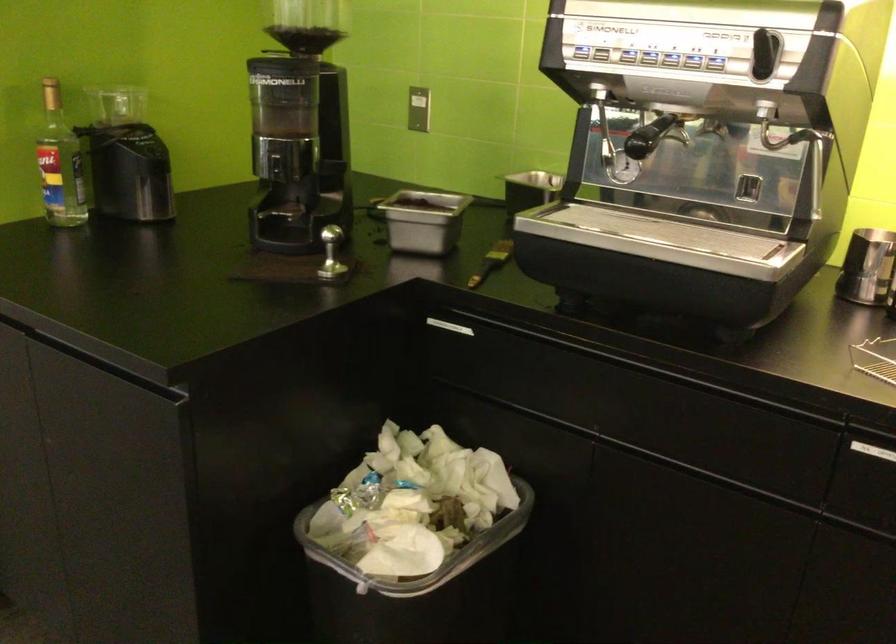
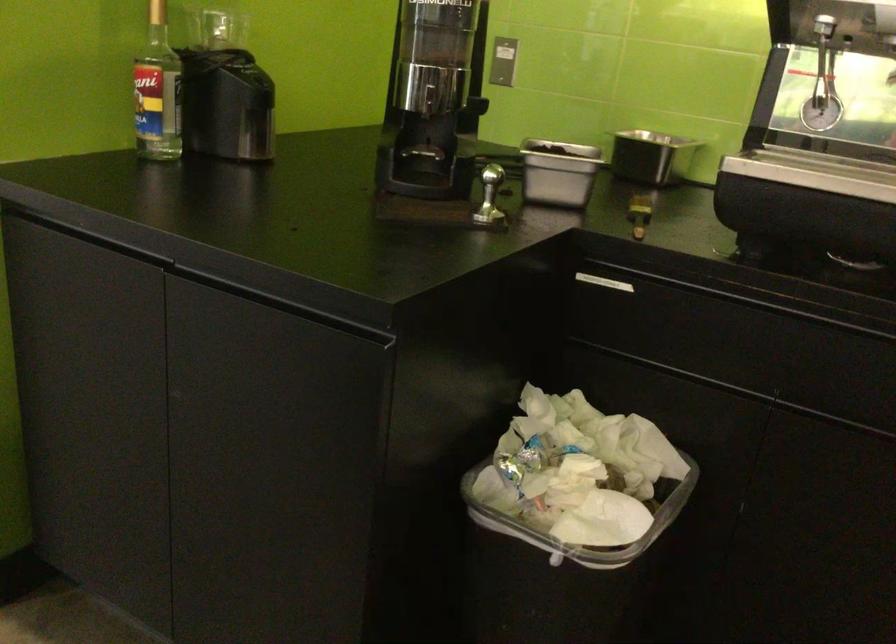
Question: The camera is either moving clockwise (left) or counter-clockwise (right) around the object. The first image is from the beginning of the video and the second image is from the end. Is the camera moving left or right when shooting the video?

Choices:
 (A) Left
 (B) Right

Answer: (A)